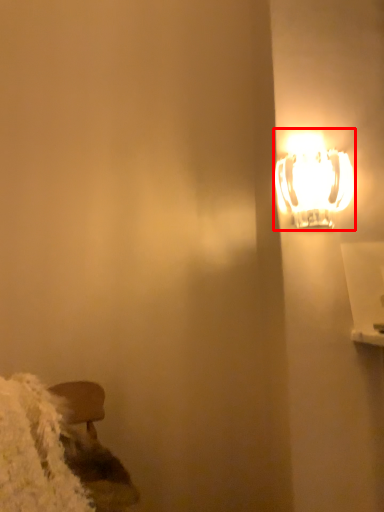
Question: Considering the relative positions of lamp (annotated by the red box) and wide in the image provided, where is lamp (annotated by the red box) located with respect to the staircase?

Choices:
 (A) left
 (B) right

Answer: (B)